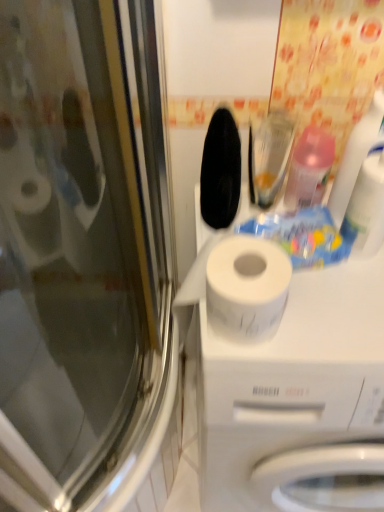
Question: Does pink translucent bottle at upper right, the 1th cleaning product viewed from the left, appear on the right side of white matte toilet paper at center?

Choices:
 (A) no
 (B) yes

Answer: (A)

Question: Is pink translucent bottle at upper right, acting as the second cleaning product starting from the right, at the left side of white matte toilet paper at center?

Choices:
 (A) yes
 (B) no

Answer: (A)

Question: From the image's perspective, is pink translucent bottle at upper right, acting as the second cleaning product starting from the right, located beneath white matte toilet paper at center?

Choices:
 (A) yes
 (B) no

Answer: (B)

Question: Is white matte toilet paper at center surrounded by pink translucent bottle at upper right, the 1th cleaning product viewed from the left?

Choices:
 (A) yes
 (B) no

Answer: (B)

Question: Are pink translucent bottle at upper right, acting as the second cleaning product starting from the right, and white matte toilet paper at center making contact?

Choices:
 (A) no
 (B) yes

Answer: (A)

Question: From a real-world perspective, is pink translucent bottle at upper right, the 1th cleaning product viewed from the left, physically above white matte toilet paper at center?

Choices:
 (A) no
 (B) yes

Answer: (B)

Question: Is pink translucent bottle at upper right, the 1th cleaning product viewed from the left, at the left side of translucent plastic spray bottle at upper right, which is the first cleaning product in right-to-left order?

Choices:
 (A) no
 (B) yes

Answer: (B)

Question: Is pink translucent bottle at upper right, acting as the second cleaning product starting from the right, facing towards translucent plastic spray bottle at upper right, the second cleaning product positioned from the left?

Choices:
 (A) yes
 (B) no

Answer: (B)

Question: Is pink translucent bottle at upper right, acting as the second cleaning product starting from the right, far away from translucent plastic spray bottle at upper right, which is the first cleaning product in right-to-left order?

Choices:
 (A) yes
 (B) no

Answer: (B)

Question: From a real-world perspective, is pink translucent bottle at upper right, the 1th cleaning product viewed from the left, on translucent plastic spray bottle at upper right, the second cleaning product positioned from the left?

Choices:
 (A) no
 (B) yes

Answer: (A)

Question: Would you say pink translucent bottle at upper right, the 1th cleaning product viewed from the left, is outside translucent plastic spray bottle at upper right, the second cleaning product positioned from the left?

Choices:
 (A) yes
 (B) no

Answer: (A)

Question: Considering the relative sizes of pink translucent bottle at upper right, acting as the second cleaning product starting from the right, and translucent plastic spray bottle at upper right, which is the first cleaning product in right-to-left order, in the image provided, is pink translucent bottle at upper right, acting as the second cleaning product starting from the right, thinner than translucent plastic spray bottle at upper right, which is the first cleaning product in right-to-left order,?

Choices:
 (A) no
 (B) yes

Answer: (A)

Question: Considering the relative positions of transparent glass screen door at left and pink translucent bottle at upper right, the 1th cleaning product viewed from the left, in the image provided, is transparent glass screen door at left to the right of pink translucent bottle at upper right, the 1th cleaning product viewed from the left, from the viewer's perspective?

Choices:
 (A) yes
 (B) no

Answer: (B)